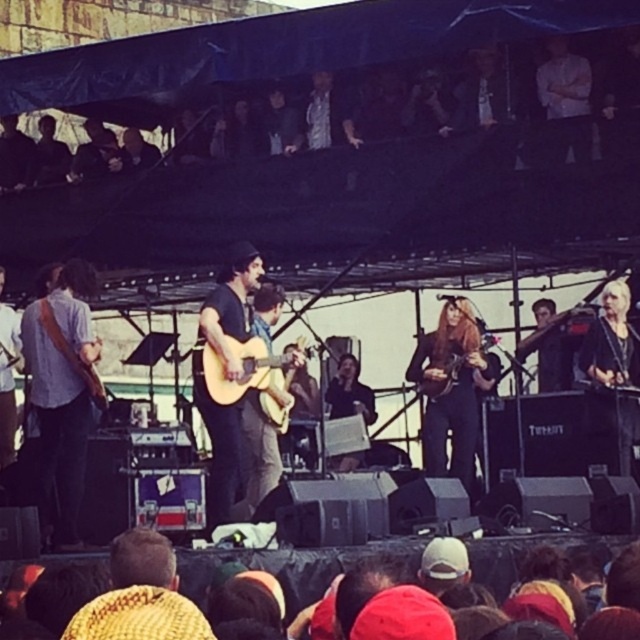
Question: Can you confirm if light brown acoustic guitar at center is bigger than wooden acoustic guitar at center?

Choices:
 (A) yes
 (B) no

Answer: (A)

Question: Does light brown acoustic guitar at center appear over wooden acoustic guitar at center?

Choices:
 (A) yes
 (B) no

Answer: (A)

Question: Among these points, which one is farthest from the camera?

Choices:
 (A) (452, 362)
 (B) (214, 352)

Answer: (A)

Question: Is light brown acoustic guitar at center below wooden acoustic guitar at center?

Choices:
 (A) yes
 (B) no

Answer: (B)